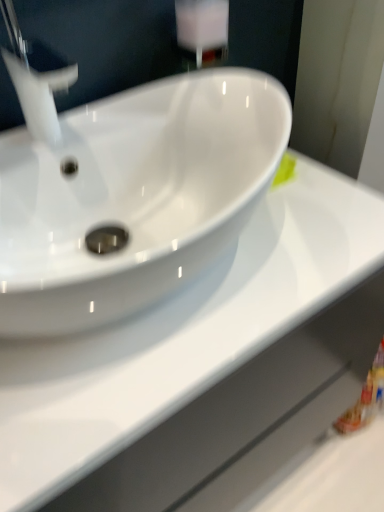
Where is `white glossy faucet at upper left`? This screenshot has height=512, width=384. white glossy faucet at upper left is located at coordinates (36, 78).

The image size is (384, 512). What do you see at coordinates (36, 78) in the screenshot?
I see `white glossy faucet at upper left` at bounding box center [36, 78].

Image resolution: width=384 pixels, height=512 pixels. I want to click on white glossy counter top at center, so coord(196,360).

Measure the distance between white glossy counter top at center and camera.

They are 16.58 inches apart.

The width and height of the screenshot is (384, 512). What do you see at coordinates (196, 360) in the screenshot? I see `white glossy counter top at center` at bounding box center [196, 360].

The width and height of the screenshot is (384, 512). I want to click on white glossy faucet at upper left, so click(x=36, y=78).

Based on the photo, which object is positioned more to the right, white glossy faucet at upper left or white glossy counter top at center?

white glossy counter top at center.

Considering the positions of objects white glossy faucet at upper left and white glossy counter top at center in the image provided, who is in front, white glossy faucet at upper left or white glossy counter top at center?

white glossy counter top at center is more forward.

Considering the positions of point (54, 84) and point (24, 344), is point (54, 84) closer or farther from the camera than point (24, 344)?

Point (54, 84).

From the image's perspective, which is above, white glossy faucet at upper left or white glossy counter top at center?

white glossy faucet at upper left is shown above in the image.

From a real-world perspective, who is located lower, white glossy faucet at upper left or white glossy counter top at center?

From a 3D spatial view, white glossy counter top at center is below.

Is white glossy faucet at upper left wider than white glossy counter top at center?

No.

Is white glossy faucet at upper left taller or shorter than white glossy counter top at center?

In the image, white glossy faucet at upper left appears to be shorter than white glossy counter top at center.

Does white glossy faucet at upper left have a smaller size compared to white glossy counter top at center?

Indeed, white glossy faucet at upper left has a smaller size compared to white glossy counter top at center.

Based on the photo, is white glossy faucet at upper left surrounding white glossy counter top at center?

That's incorrect, white glossy counter top at center is not inside white glossy faucet at upper left.

From the picture: Is white glossy faucet at upper left far from white glossy counter top at center?

That's not correct — white glossy faucet at upper left is a little close to white glossy counter top at center.

Is white glossy counter top at center at the back of white glossy faucet at upper left?

No.

Can you tell me how much white glossy faucet at upper left and white glossy counter top at center differ in facing direction?

white glossy faucet at upper left and white glossy counter top at center are facing 1.62 degrees away from each other.

How much distance is there between white glossy faucet at upper left and white glossy counter top at center?

The distance of white glossy faucet at upper left from white glossy counter top at center is 17.02 inches.

Locate an element on the screen. The height and width of the screenshot is (512, 384). tap behind the white glossy counter top at center is located at coordinates (36, 78).

Which object is positioned more to the right, white glossy counter top at center or white glossy faucet at upper left?

white glossy counter top at center is more to the right.

Relative to white glossy faucet at upper left, is white glossy counter top at center in front or behind?

Clearly, white glossy counter top at center is in front of white glossy faucet at upper left.

Considering the positions of point (130, 327) and point (28, 90), is point (130, 327) closer or farther from the camera than point (28, 90)?

Point (130, 327) is closer to the camera than point (28, 90).

From the image's perspective, would you say white glossy counter top at center is shown under white glossy faucet at upper left?

Yes.

From a real-world perspective, is white glossy counter top at center positioned above or below white glossy faucet at upper left?

From a real-world perspective, white glossy counter top at center is physically below white glossy faucet at upper left.

Which object is thinner, white glossy counter top at center or white glossy faucet at upper left?

white glossy faucet at upper left.

Considering the relative sizes of white glossy counter top at center and white glossy faucet at upper left in the image provided, is white glossy counter top at center shorter than white glossy faucet at upper left?

Incorrect, the height of white glossy counter top at center does not fall short of that of white glossy faucet at upper left.

Considering the sizes of white glossy counter top at center and white glossy faucet at upper left in the image, is white glossy counter top at center bigger or smaller than white glossy faucet at upper left?

In the image, white glossy counter top at center appears to be larger than white glossy faucet at upper left.

Is white glossy counter top at center completely or partially outside of white glossy faucet at upper left?

Yes, white glossy counter top at center is located beyond the bounds of white glossy faucet at upper left.

Is white glossy counter top at center next to white glossy faucet at upper left?

No, white glossy counter top at center is not touching white glossy faucet at upper left.

Could you tell me if white glossy counter top at center is turned towards white glossy faucet at upper left?

No, white glossy counter top at center is not aimed at white glossy faucet at upper left.

Can you tell me how much white glossy counter top at center and white glossy faucet at upper left differ in facing direction?

There is a 1.62-degree angle between the facing directions of white glossy counter top at center and white glossy faucet at upper left.

Find the location of a particular element. counter top below the white glossy faucet at upper left (from a real-world perspective) is located at coordinates (196, 360).

Locate an element on the screen. The width and height of the screenshot is (384, 512). tap to the left of white glossy counter top at center is located at coordinates (36, 78).

Locate an element on the screen. Image resolution: width=384 pixels, height=512 pixels. counter top below the white glossy faucet at upper left (from the image's perspective) is located at coordinates (196, 360).